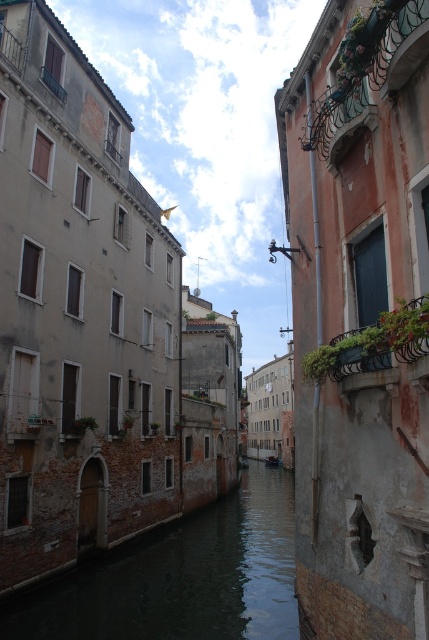
This screenshot has height=640, width=429. Describe the element at coordinates (181, 579) in the screenshot. I see `dark water at center` at that location.

Between dark water at center and wooden boat at center, which one has more height?

dark water at center

Is point (108, 561) closer to camera compared to point (271, 460)?

Yes, it is.

Locate an element on the screen. The image size is (429, 640). dark water at center is located at coordinates (181, 579).